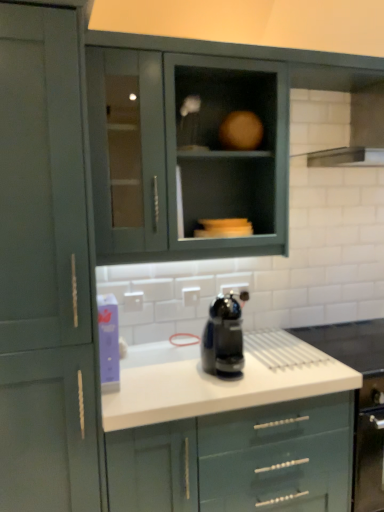
Question: Is matte gray cabinet at upper center, which is the second cabinetry from left to right, oriented away from matte green cabinet at left, the third cabinetry from the right?

Choices:
 (A) yes
 (B) no

Answer: (B)

Question: Is matte gray cabinet at upper center, which is counted as the second cabinetry, starting from the right, bigger than matte green cabinet at left, the third cabinetry from the right?

Choices:
 (A) no
 (B) yes

Answer: (A)

Question: Is matte gray cabinet at upper center, which is counted as the second cabinetry, starting from the right, far from matte green cabinet at left, the 1th cabinetry viewed from the left?

Choices:
 (A) yes
 (B) no

Answer: (B)

Question: Is the position of matte gray cabinet at upper center, which is the second cabinetry from left to right, more distant than that of matte green cabinet at left, the third cabinetry from the right?

Choices:
 (A) yes
 (B) no

Answer: (A)

Question: From the image's perspective, does matte gray cabinet at upper center, which is the second cabinetry from left to right, appear lower than matte green cabinet at left, the third cabinetry from the right?

Choices:
 (A) no
 (B) yes

Answer: (A)

Question: From their relative heights in the image, would you say matte gray cabinet at upper center, which is counted as the second cabinetry, starting from the right, is taller or shorter than stainless steel exhaust hood at upper right?

Choices:
 (A) tall
 (B) short

Answer: (A)

Question: Is point (115, 245) positioned closer to the camera than point (314, 95)?

Choices:
 (A) farther
 (B) closer

Answer: (B)

Question: From a real-world perspective, is matte gray cabinet at upper center, which is the second cabinetry from left to right, physically located above or below stainless steel exhaust hood at upper right?

Choices:
 (A) below
 (B) above

Answer: (A)

Question: Based on their sizes in the image, would you say matte gray cabinet at upper center, which is counted as the second cabinetry, starting from the right, is bigger or smaller than stainless steel exhaust hood at upper right?

Choices:
 (A) big
 (B) small

Answer: (A)

Question: Is black glossy coffee maker at center situated inside matte green cabinet at left, the 1th cabinetry viewed from the left, or outside?

Choices:
 (A) inside
 (B) outside

Answer: (B)

Question: In terms of width, does black glossy coffee maker at center look wider or thinner when compared to matte green cabinet at left, the 1th cabinetry viewed from the left?

Choices:
 (A) thin
 (B) wide

Answer: (A)

Question: Does point (210, 305) appear closer or farther from the camera than point (28, 450)?

Choices:
 (A) farther
 (B) closer

Answer: (A)

Question: From a real-world perspective, is black glossy coffee maker at center physically located above or below matte green cabinet at left, the 1th cabinetry viewed from the left?

Choices:
 (A) below
 (B) above

Answer: (A)

Question: Looking at their shapes, would you say matte gray cabinet at upper center, which is the second cabinetry from left to right, is wider or thinner than matte green cabinet at left, the third cabinetry from the right?

Choices:
 (A) thin
 (B) wide

Answer: (A)

Question: Does point (155, 128) appear closer or farther from the camera than point (66, 133)?

Choices:
 (A) farther
 (B) closer

Answer: (A)